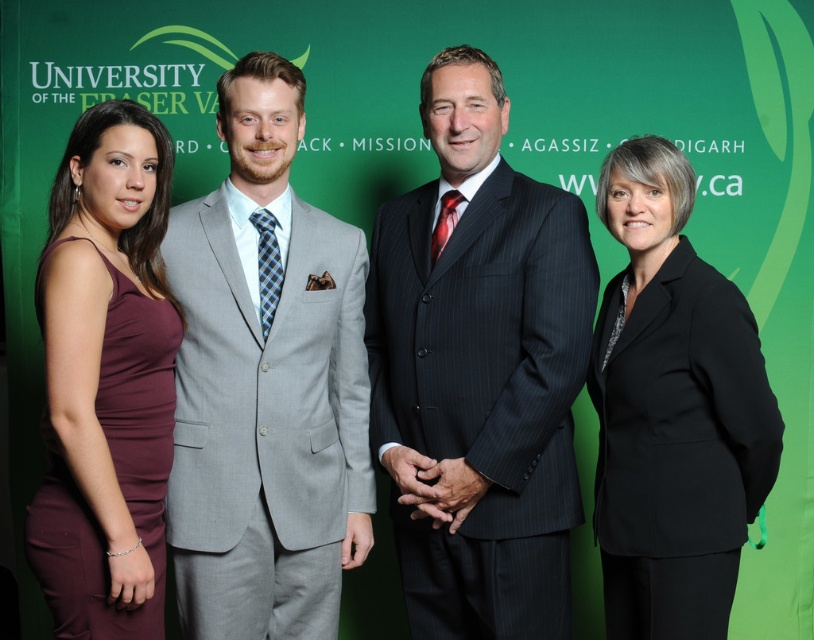
You are standing in front of the University of the Fraser Valley backdrop. There is a point at coordinates (479, 371). Which object from the scene is located at this point?

The point at coordinates (479, 371) corresponds to the dark gray pinstripe suit at center.

You are a photographer setting up for a group photo. You need to ensure that all clothing items are visible. Given that the black matte blazer at right is larger than the maroon satin dress at left, which clothing item should you focus on first to avoid any obstruction?

The black matte blazer at right is larger and should be focused on first to ensure it doesn t get obstructed by the smaller maroon satin dress at left.